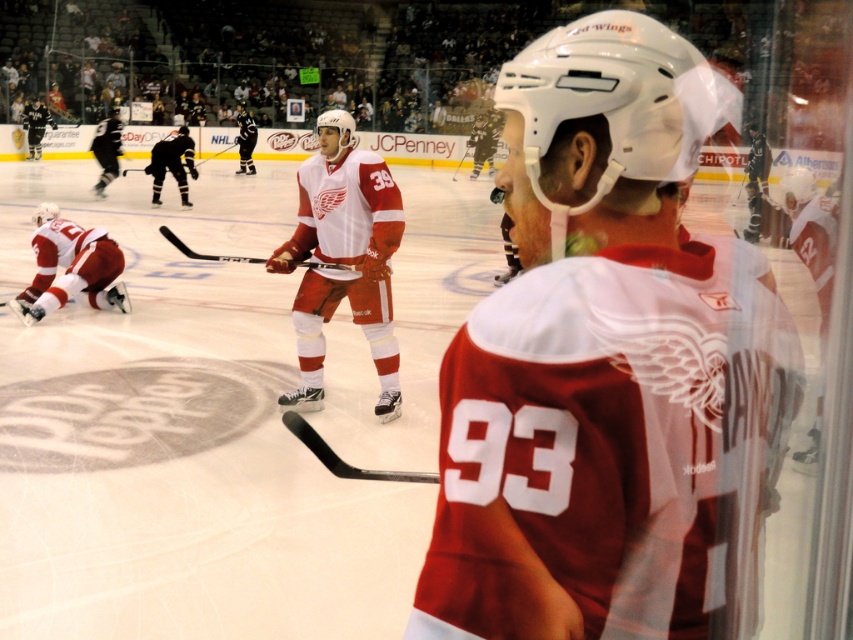
Is black matte hockey stick at left above white matte jersey at center?

No, black matte hockey stick at left is not above white matte jersey at center.

Who is shorter, black matte hockey stick at left or white matte jersey at center?

white matte jersey at center is shorter.

Is point (155, 157) closer to camera compared to point (244, 172)?

That is True.

Find the location of a particular element. The image size is (853, 640). black matte hockey stick at left is located at coordinates (172, 163).

Who is more forward, (177, 170) or (27, 122)?

Point (177, 170) is in front.

Is black matte hockey stick at left to the right of black jersey at left from the viewer's perspective?

Indeed, black matte hockey stick at left is positioned on the right side of black jersey at left.

Where is `black matte hockey stick at left`? The image size is (853, 640). black matte hockey stick at left is located at coordinates (172, 163).

Locate an element on the screen. black matte hockey stick at left is located at coordinates (172, 163).

Does matte red jersey at center appear over black jersey at left?

Actually, matte red jersey at center is below black jersey at left.

Who is lower down, matte red jersey at center or black jersey at left?

Positioned lower is matte red jersey at center.

Between point (668, 129) and point (38, 116), which one is positioned in front?

Point (668, 129) is in front.

Where is `matte red jersey at center`? The image size is (853, 640). matte red jersey at center is located at coordinates (608, 368).